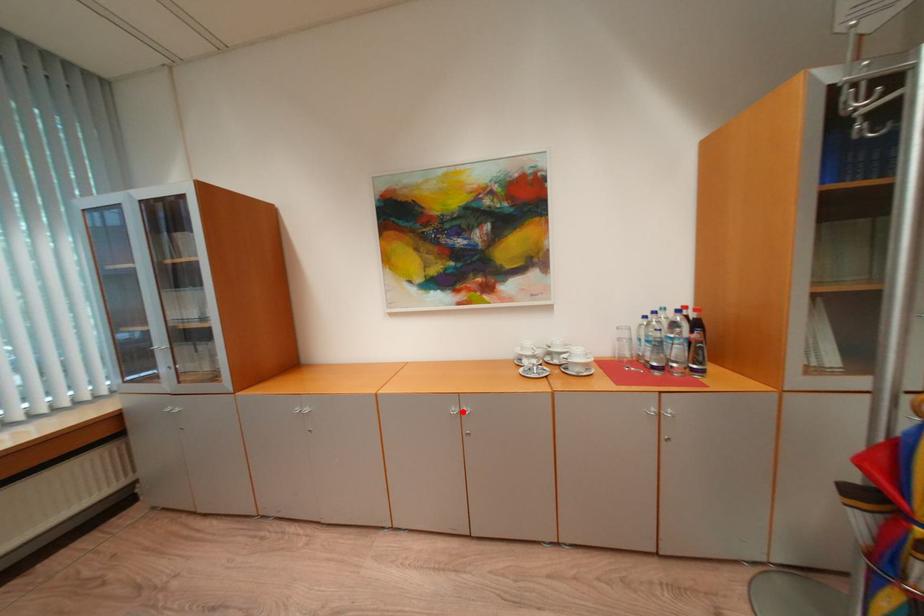
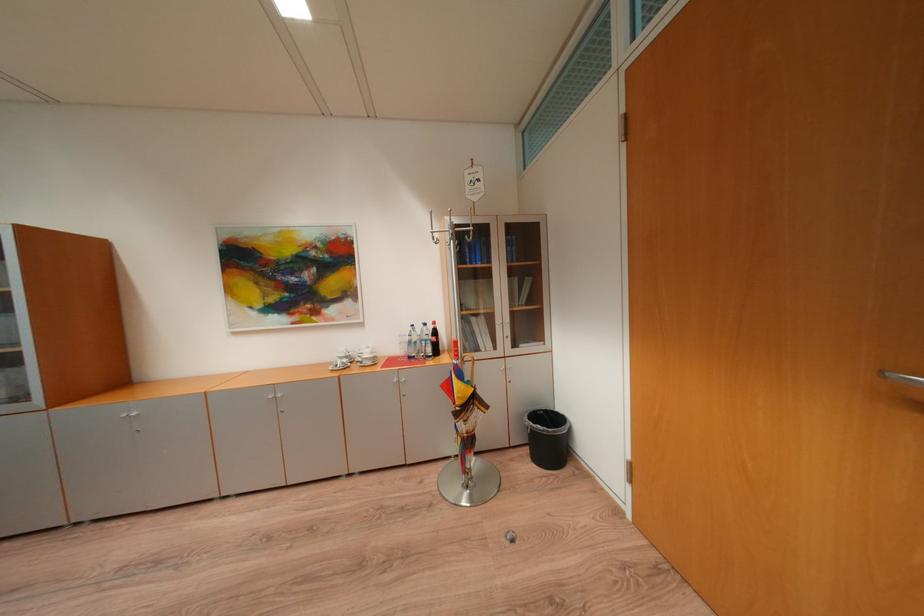
The point at the highlighted location is marked in the first image. Where is the corresponding point in the second image?

(280, 398)